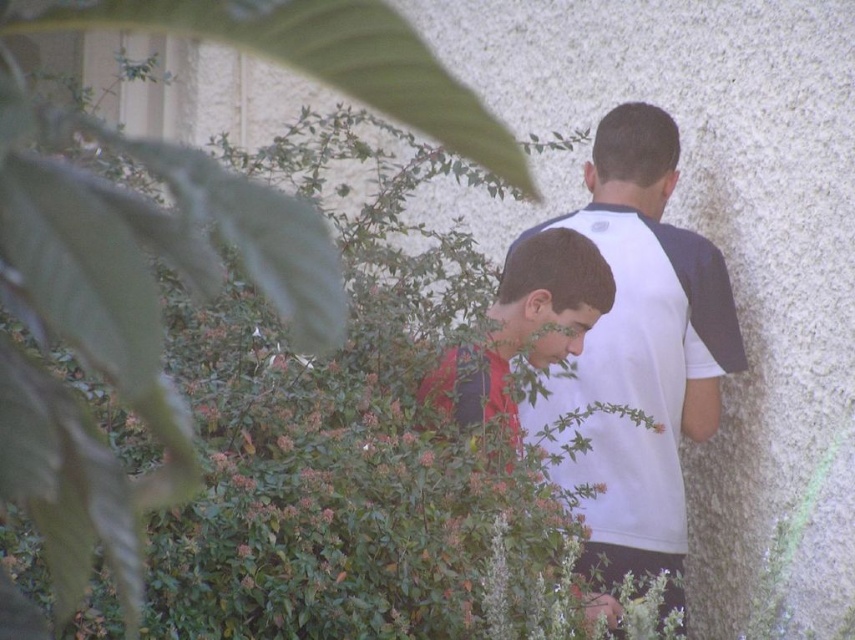
Question: Which object is the closest to the matte red shirt at center?

Choices:
 (A) white fabric shirt at center
 (B) green leafy bush at center

Answer: (A)

Question: Can you confirm if white fabric shirt at center is positioned to the left of matte red shirt at center?

Choices:
 (A) no
 (B) yes

Answer: (A)

Question: Is white fabric shirt at center wider than matte red shirt at center?

Choices:
 (A) yes
 (B) no

Answer: (A)

Question: Which point is farther to the camera?

Choices:
 (A) (594, 291)
 (B) (316, 262)
 (C) (728, 369)

Answer: (C)

Question: Can you confirm if green leafy bush at center is positioned to the right of matte red shirt at center?

Choices:
 (A) yes
 (B) no

Answer: (B)

Question: Which of the following is the closest to the observer?

Choices:
 (A) (286, 294)
 (B) (535, 422)

Answer: (A)